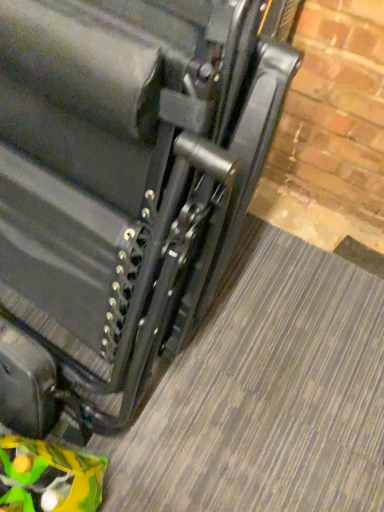
Question: Is green plastic toy at lower left facing towards matte black suitcase at center?

Choices:
 (A) yes
 (B) no

Answer: (B)

Question: Can you confirm if green plastic toy at lower left is thinner than matte black suitcase at center?

Choices:
 (A) yes
 (B) no

Answer: (A)

Question: Is the position of green plastic toy at lower left less distant than that of matte black suitcase at center?

Choices:
 (A) yes
 (B) no

Answer: (B)

Question: Is green plastic toy at lower left positioned behind matte black suitcase at center?

Choices:
 (A) yes
 (B) no

Answer: (A)

Question: Is green plastic toy at lower left surrounding matte black suitcase at center?

Choices:
 (A) yes
 (B) no

Answer: (B)

Question: Is green plastic toy at lower left located outside matte black suitcase at center?

Choices:
 (A) yes
 (B) no

Answer: (A)

Question: Is matte black suitcase at center thinner than green plastic toy at lower left?

Choices:
 (A) yes
 (B) no

Answer: (B)

Question: Does matte black suitcase at center appear on the right side of green plastic toy at lower left?

Choices:
 (A) no
 (B) yes

Answer: (B)

Question: Does matte black suitcase at center have a larger size compared to green plastic toy at lower left?

Choices:
 (A) yes
 (B) no

Answer: (A)

Question: Does matte black suitcase at center touch green plastic toy at lower left?

Choices:
 (A) no
 (B) yes

Answer: (A)

Question: Does matte black suitcase at center lie in front of green plastic toy at lower left?

Choices:
 (A) yes
 (B) no

Answer: (A)

Question: From the image's perspective, is matte black suitcase at center under green plastic toy at lower left?

Choices:
 (A) yes
 (B) no

Answer: (B)

Question: Is point (54, 212) positioned closer to the camera than point (44, 441)?

Choices:
 (A) closer
 (B) farther

Answer: (A)